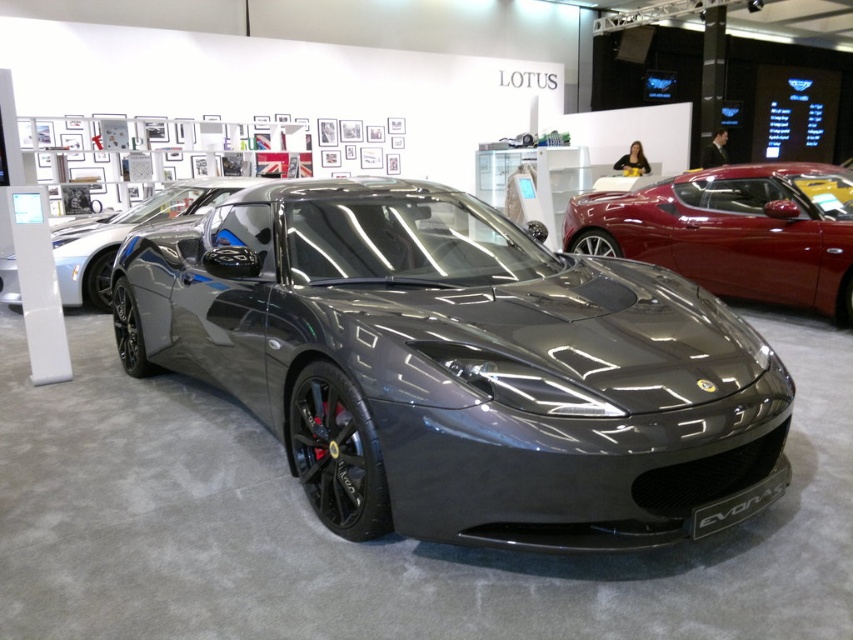
Question: Does satin black sports car at center appear on the right side of glossy metallic sports car at center?

Choices:
 (A) yes
 (B) no

Answer: (B)

Question: Does satin black sports car at center lie in front of glossy metallic sports car at center?

Choices:
 (A) yes
 (B) no

Answer: (A)

Question: Among these points, which one is nearest to the camera?

Choices:
 (A) (699, 212)
 (B) (248, 218)

Answer: (B)

Question: Does satin black sports car at center lie behind glossy metallic sports car at center?

Choices:
 (A) no
 (B) yes

Answer: (A)